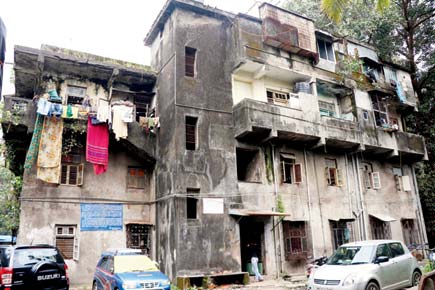
The image size is (435, 290). Find the location of `door to building`. door to building is located at coordinates (252, 238).